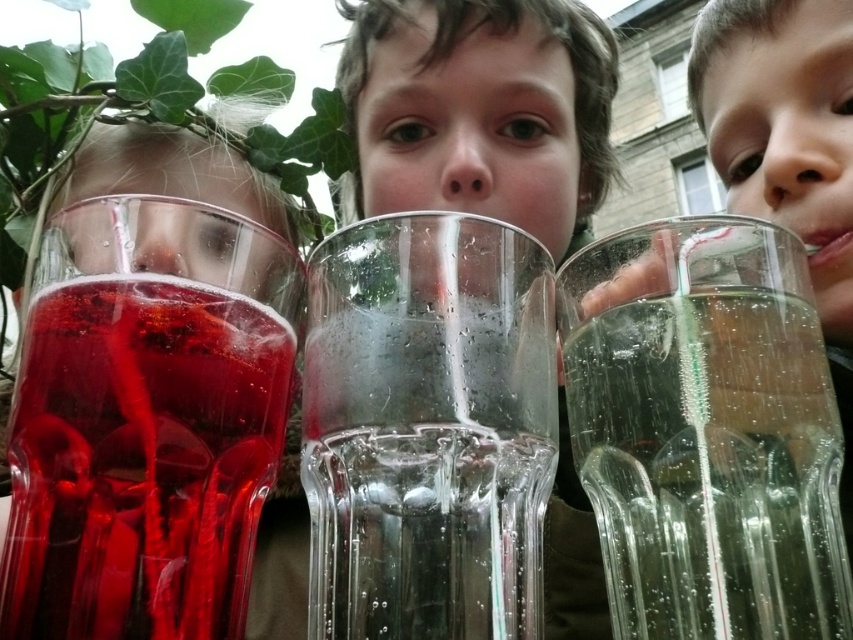
You are a beverage delivery robot and need to deliver a new glass of water to the children. The existing glasses are positioned at specific coordinates. The transparent glass cup at center is at point (427, 428). Where should you place the new glass of water to avoid overlapping with the existing ones?

Place the new glass of water either to the left of the transparent glass cup at center or to the right, ensuring it does not occupy the same coordinates as point (427, 428) where the transparent glass cup at center is located.

You are a photographer trying to capture the matte glass juice at left in the image. Based on its position, which direction should you move your camera to center it in the frame?

The matte glass juice at left is located at point coordinates, so you should move your camera to the right to center it in the frame.